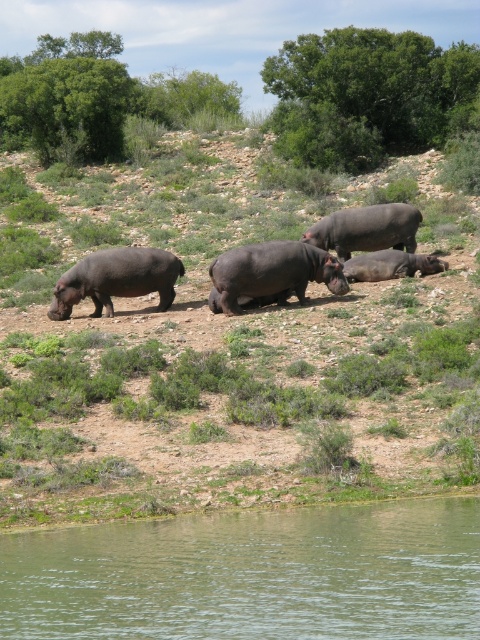
Question: Among these objects, which one is farthest from the camera?

Choices:
 (A) smooth dark gray hippo at center
 (B) greenish water at lower left
 (C) dark gray matte hippo at left
 (D) matte gray hippo at center

Answer: (A)

Question: Does greenish water at lower left have a lesser width compared to smooth dark gray hippo at center?

Choices:
 (A) no
 (B) yes

Answer: (B)

Question: From the image, what is the correct spatial relationship of dark gray matte hippo at left in relation to smooth dark gray hippo at center?

Choices:
 (A) right
 (B) left

Answer: (B)

Question: Is dark gray matte hippo at left in front of dark gray matte hippo at center?

Choices:
 (A) no
 (B) yes

Answer: (B)

Question: Which of the following is the closest to the observer?

Choices:
 (A) (84, 284)
 (B) (422, 256)

Answer: (A)

Question: Which is farther from the dark gray matte hippo at center?

Choices:
 (A) greenish water at lower left
 (B) matte gray hippo at center
 (C) dark gray matte hippo at left

Answer: (A)